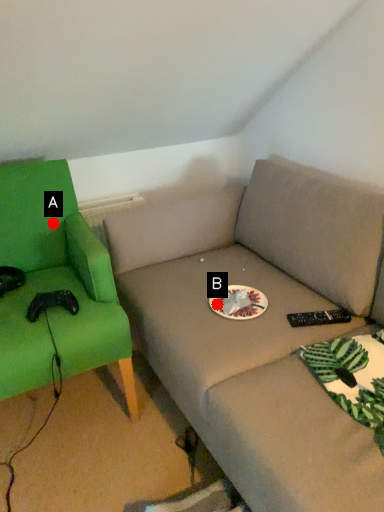
Question: Two points are circled on the image, labeled by A and B beside each circle. Which point appears closest to the camera in this image?

Choices:
 (A) A is closer
 (B) B is closer

Answer: (B)